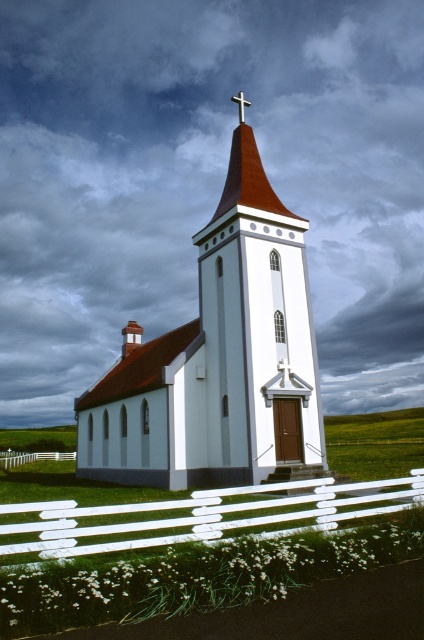
Question: Estimate the real-world distances between objects in this image. Which object is closer to the white wooden fence at lower left?

Choices:
 (A) metallic cross at upper center
 (B) white wooden fence at lower center
 (C) white smooth church at center

Answer: (C)

Question: Can you confirm if white smooth church at center is bigger than metallic cross at upper center?

Choices:
 (A) yes
 (B) no

Answer: (B)

Question: In this image, where is white smooth church at center located relative to white wooden fence at lower center?

Choices:
 (A) below
 (B) above

Answer: (B)

Question: From the image, what is the correct spatial relationship of white smooth church at center in relation to metallic cross at upper center?

Choices:
 (A) left
 (B) right

Answer: (A)

Question: Which object appears farthest from the camera in this image?

Choices:
 (A) metallic cross at upper center
 (B) white wooden fence at lower left

Answer: (B)

Question: Which of the following is the closest to the observer?

Choices:
 (A) white wooden fence at lower center
 (B) metallic cross at upper center
 (C) white wooden fence at lower left

Answer: (A)